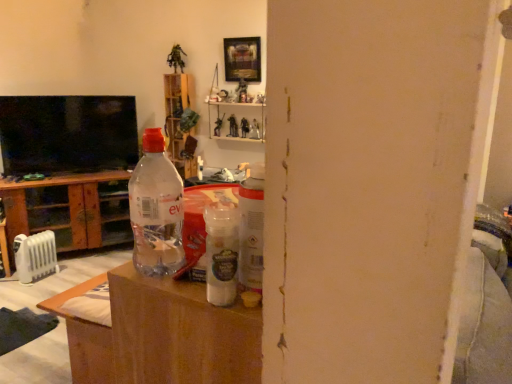
Question: Is wooden picture frame at upper center aimed at wooden shelf at upper center?

Choices:
 (A) yes
 (B) no

Answer: (B)

Question: From a real-world perspective, is wooden picture frame at upper center positioned over wooden shelf at upper center based on gravity?

Choices:
 (A) yes
 (B) no

Answer: (A)

Question: Is wooden picture frame at upper center positioned beyond the bounds of wooden shelf at upper center?

Choices:
 (A) yes
 (B) no

Answer: (A)

Question: Is wooden picture frame at upper center not close to wooden shelf at upper center?

Choices:
 (A) no
 (B) yes

Answer: (A)

Question: Could wooden shelf at upper center be considered to be inside wooden picture frame at upper center?

Choices:
 (A) no
 (B) yes

Answer: (A)

Question: Considering the positions of wooden shelf at upper center and transparent plastic cabinet at left in the image, is wooden shelf at upper center wider or thinner than transparent plastic cabinet at left?

Choices:
 (A) thin
 (B) wide

Answer: (A)

Question: From a real-world perspective, is wooden shelf at upper center physically located above or below transparent plastic cabinet at left?

Choices:
 (A) above
 (B) below

Answer: (A)

Question: Is wooden shelf at upper center to the left or to the right of transparent plastic cabinet at left in the image?

Choices:
 (A) left
 (B) right

Answer: (B)

Question: Considering their positions, is wooden shelf at upper center located in front of or behind transparent plastic cabinet at left?

Choices:
 (A) behind
 (B) front

Answer: (A)

Question: Considering the positions of point (254, 66) and point (166, 86), is point (254, 66) closer or farther from the camera than point (166, 86)?

Choices:
 (A) farther
 (B) closer

Answer: (B)

Question: Looking at the image, does wooden picture frame at upper center seem bigger or smaller compared to wooden shelf at upper center?

Choices:
 (A) small
 (B) big

Answer: (A)

Question: Considering the positions of wooden picture frame at upper center and wooden shelf at upper center in the image, is wooden picture frame at upper center wider or thinner than wooden shelf at upper center?

Choices:
 (A) thin
 (B) wide

Answer: (A)

Question: Visually, is wooden picture frame at upper center positioned to the left or to the right of wooden shelf at upper center?

Choices:
 (A) right
 (B) left

Answer: (A)

Question: Considering the positions of transparent plastic bottle at center and white plastic radiator at lower left in the image, is transparent plastic bottle at center wider or thinner than white plastic radiator at lower left?

Choices:
 (A) thin
 (B) wide

Answer: (A)

Question: From a real-world perspective, is transparent plastic bottle at center physically located above or below white plastic radiator at lower left?

Choices:
 (A) above
 (B) below

Answer: (A)